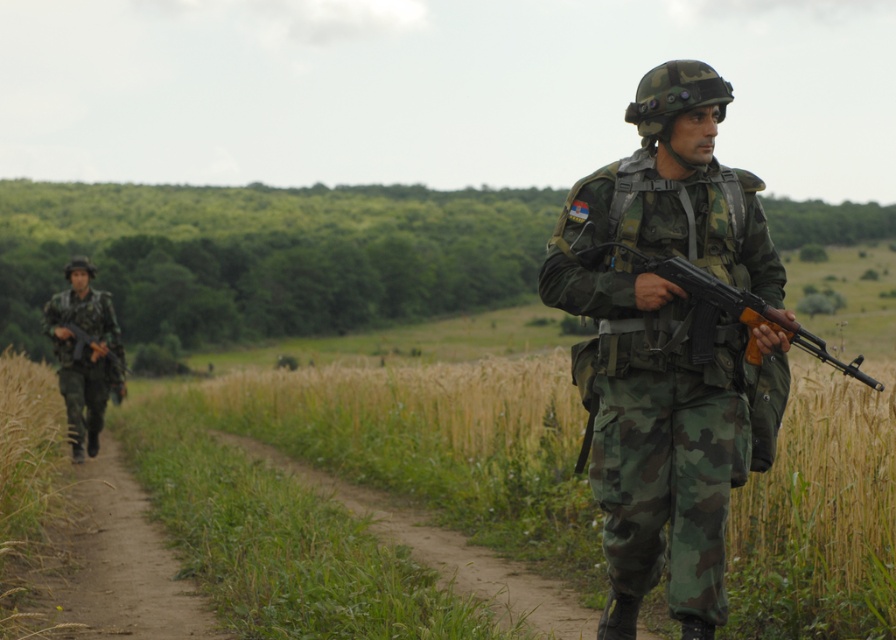
Question: Among these points, which one is farthest from the camera?

Choices:
 (A) (881, 387)
 (B) (89, 432)

Answer: (B)

Question: In this image, where is dirt path at center located relative to camouflage uniform at left?

Choices:
 (A) below
 (B) above

Answer: (A)

Question: Among these objects, which one is nearest to the camera?

Choices:
 (A) matte black rifle at center
 (B) camouflage uniform at left
 (C) dirt path at center
 (D) camo uniform at center

Answer: (A)

Question: Is dirt path at center further to the viewer compared to matte black rifle at center?

Choices:
 (A) yes
 (B) no

Answer: (A)

Question: Can you confirm if dirt path at center is wider than camouflage uniform at left?

Choices:
 (A) yes
 (B) no

Answer: (A)

Question: Which of these objects is positioned closest to the matte black rifle at center?

Choices:
 (A) dirt path at center
 (B) camo uniform at center

Answer: (B)